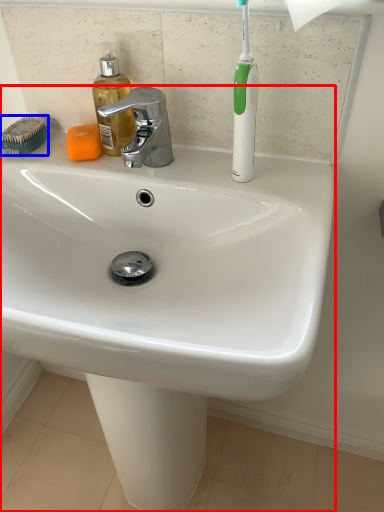
Question: Which object appears closest to the camera in this image, sink (highlighted by a red box) or comb (highlighted by a blue box)?

Choices:
 (A) sink
 (B) comb

Answer: (A)